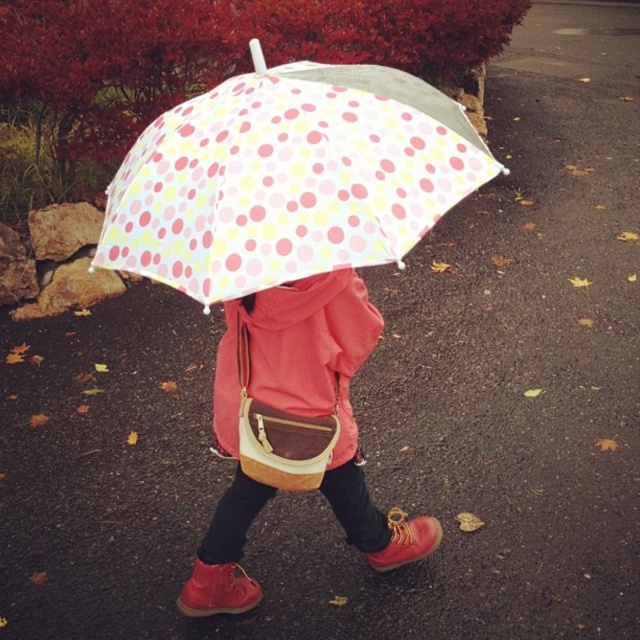
Which of these two, matte yellow crossbody bag at center or matte pink jacket at center, stands taller?

With more height is matte yellow crossbody bag at center.

In the scene shown: Is matte yellow crossbody bag at center to the left of matte pink jacket at center from the viewer's perspective?

Incorrect, matte yellow crossbody bag at center is not on the left side of matte pink jacket at center.

From the picture: Who is more distant from viewer, (358, 301) or (227, 412)?

The point (227, 412) is more distant.

Where is `matte yellow crossbody bag at center`? matte yellow crossbody bag at center is located at coordinates (316, 394).

Does polka dot fabric umbrella at center have a smaller size compared to matte yellow crossbody bag at center?

Indeed, polka dot fabric umbrella at center has a smaller size compared to matte yellow crossbody bag at center.

In the scene shown: Between polka dot fabric umbrella at center and matte yellow crossbody bag at center, which one appears on the right side from the viewer's perspective?

From the viewer's perspective, matte yellow crossbody bag at center appears more on the right side.

The width and height of the screenshot is (640, 640). Describe the element at coordinates (289, 179) in the screenshot. I see `polka dot fabric umbrella at center` at that location.

Where is `polka dot fabric umbrella at center`? This screenshot has width=640, height=640. polka dot fabric umbrella at center is located at coordinates (289, 179).

Does point (292, 262) lie in front of point (230, 424)?

Yes, point (292, 262) is in front of point (230, 424).

Which is more to the right, polka dot fabric umbrella at center or matte pink jacket at center?

From the viewer's perspective, matte pink jacket at center appears more on the right side.

Where is `polka dot fabric umbrella at center`? polka dot fabric umbrella at center is located at coordinates (289, 179).